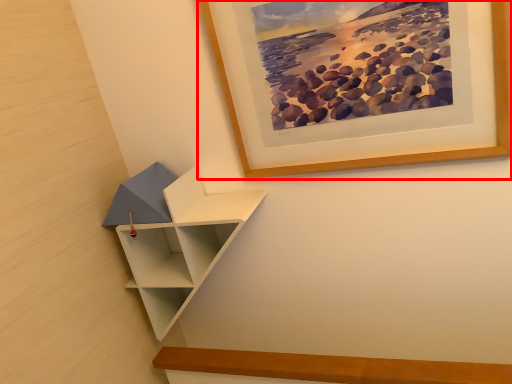
Question: Where is picture frame (annotated by the red box) located in relation to shelf in the image?

Choices:
 (A) left
 (B) right

Answer: (B)